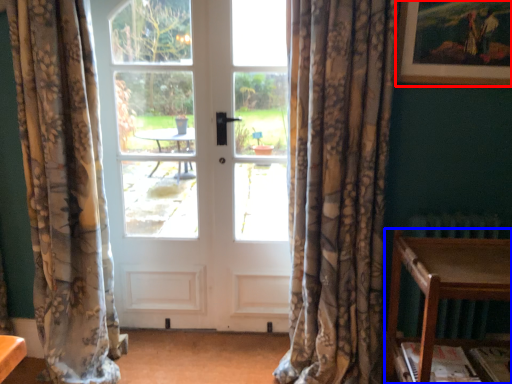
Question: Which point is closer to the camera, picture frame (highlighted by a red box) or table (highlighted by a blue box)?

Choices:
 (A) picture frame
 (B) table

Answer: (B)